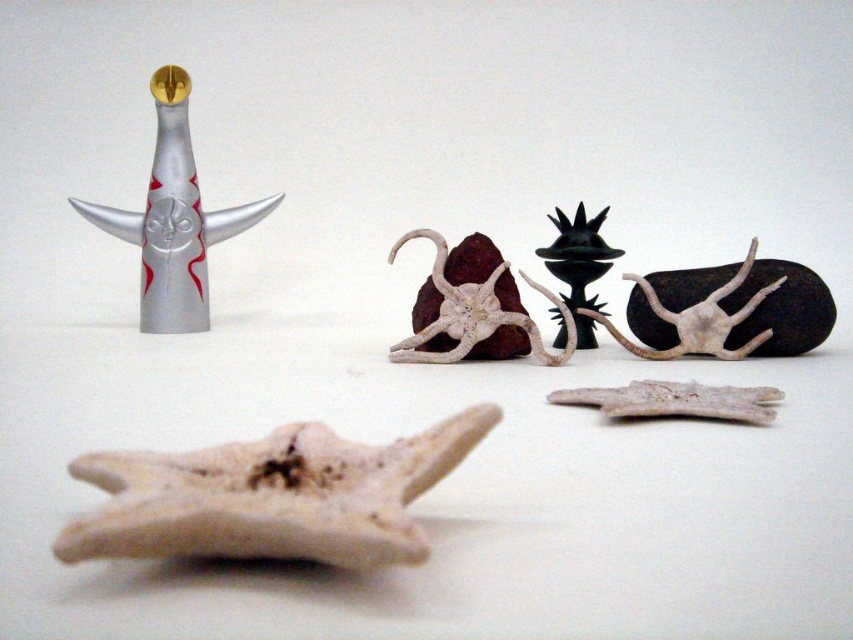
Question: Which of the following is the closest to the observer?

Choices:
 (A) black matte sculpture at center
 (B) white matte starfish at center-right

Answer: (B)

Question: Does white matte bone at center appear over white matte starfish at center?

Choices:
 (A) yes
 (B) no

Answer: (B)

Question: Among these objects, which one is nearest to the camera?

Choices:
 (A) white matte starfish at center-right
 (B) transparent glass figurine at upper left
 (C) white matte starfish at center
 (D) black matte sculpture at center

Answer: (C)

Question: Can you confirm if transparent glass figurine at upper left is bigger than white matte starfish at center-right?

Choices:
 (A) yes
 (B) no

Answer: (A)

Question: Estimate the real-world distances between objects in this image. Which object is closer to the white matte bone at center?

Choices:
 (A) white matte starfish at center-right
 (B) black matte sculpture at center
 (C) white matte starfish at center
 (D) transparent glass figurine at upper left

Answer: (C)

Question: Does white matte bone at center have a smaller size compared to transparent glass figurine at upper left?

Choices:
 (A) no
 (B) yes

Answer: (B)